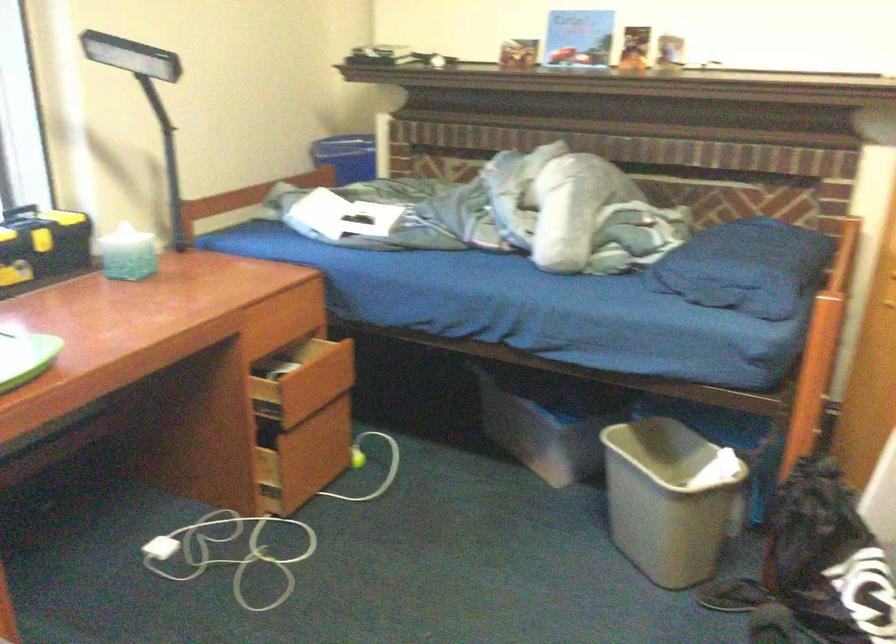
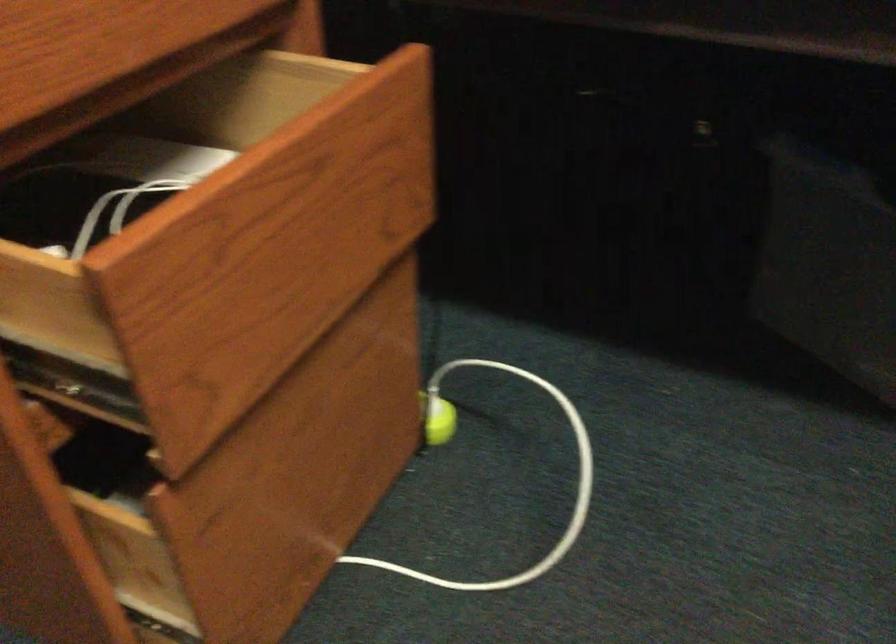
Where in the second image is the point corresponding to (x=354, y=462) from the first image?

(437, 420)